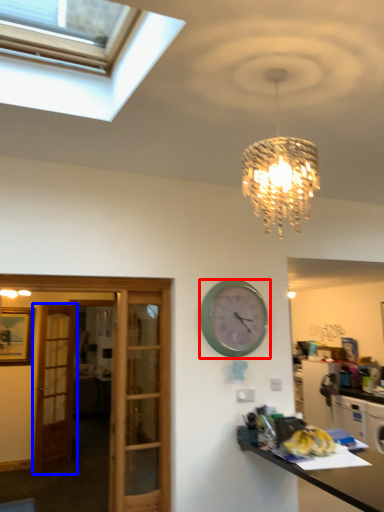
Question: Which object is further to the camera taking this photo, wall clock (highlighted by a red box) or door (highlighted by a blue box)?

Choices:
 (A) wall clock
 (B) door

Answer: (B)